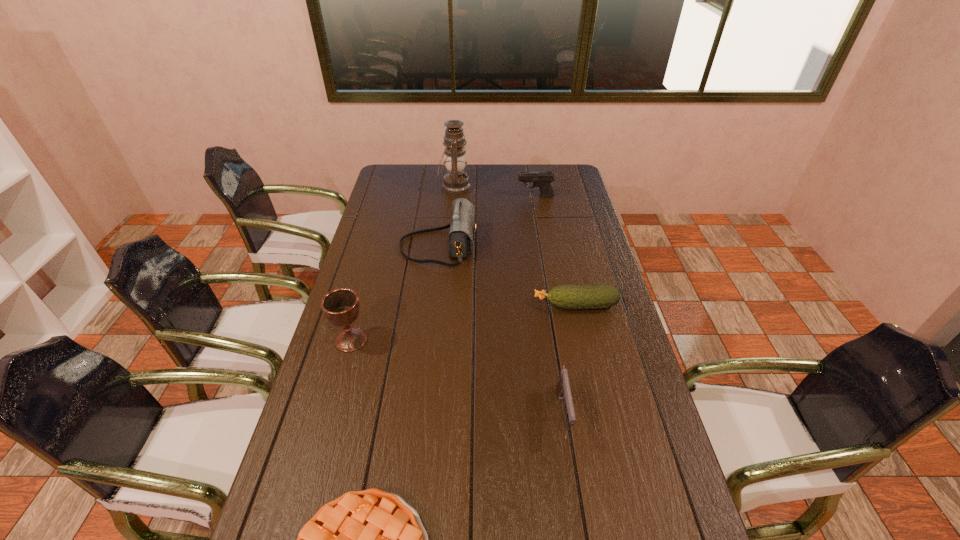
Locate an element on the screen. This screenshot has width=960, height=540. pistol present at the right edge is located at coordinates (543, 180).

This screenshot has height=540, width=960. In order to click on cucumber at the right edge in this screenshot , I will do `click(600, 296)`.

You are a GUI agent. You are given a task and a screenshot of the screen. Output one action in this format:
    pyautogui.click(x=<x>, y=<y>)
    Task: Click on the vacant area at the far edge of the desktop
    Image resolution: width=960 pixels, height=540 pixels.
    Given the screenshot: What is the action you would take?
    pyautogui.click(x=516, y=176)

This screenshot has height=540, width=960. I want to click on vacant area at the left edge, so coord(383,242).

In the image, there is a desktop. At what (x,y) coordinates should I click in order to perform the action: click on free space at the right edge. Please return your answer as a coordinate pair (x, y). This screenshot has height=540, width=960. Looking at the image, I should click on (567, 232).

What are the coordinates of `vacant space at the far right corner` in the screenshot? It's located at (570, 181).

At what (x,y) coordinates should I click in order to perform the action: click on free space between the farther pistol and the oil lamp. Please return your answer as a coordinate pair (x, y). Image resolution: width=960 pixels, height=540 pixels. Looking at the image, I should click on (495, 191).

Find the location of a particular element. The width and height of the screenshot is (960, 540). vacant area that lies between the farther pistol and the tallest object is located at coordinates (495, 191).

Where is `vacant area that lies between the farther pistol and the cucumber`? vacant area that lies between the farther pistol and the cucumber is located at coordinates (556, 251).

Find the location of `free space between the shoulder bag and the nearer pistol`. free space between the shoulder bag and the nearer pistol is located at coordinates (500, 329).